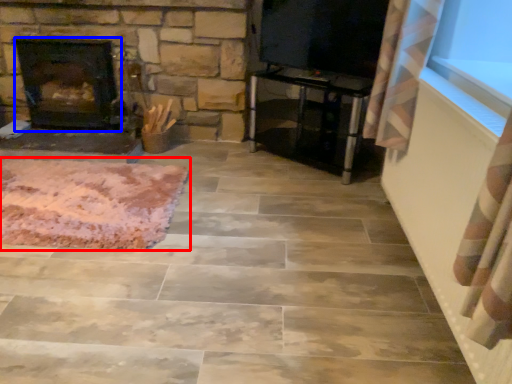
Question: Which point is closer to the camera, mat (highlighted by a red box) or fireplace (highlighted by a blue box)?

Choices:
 (A) mat
 (B) fireplace

Answer: (A)